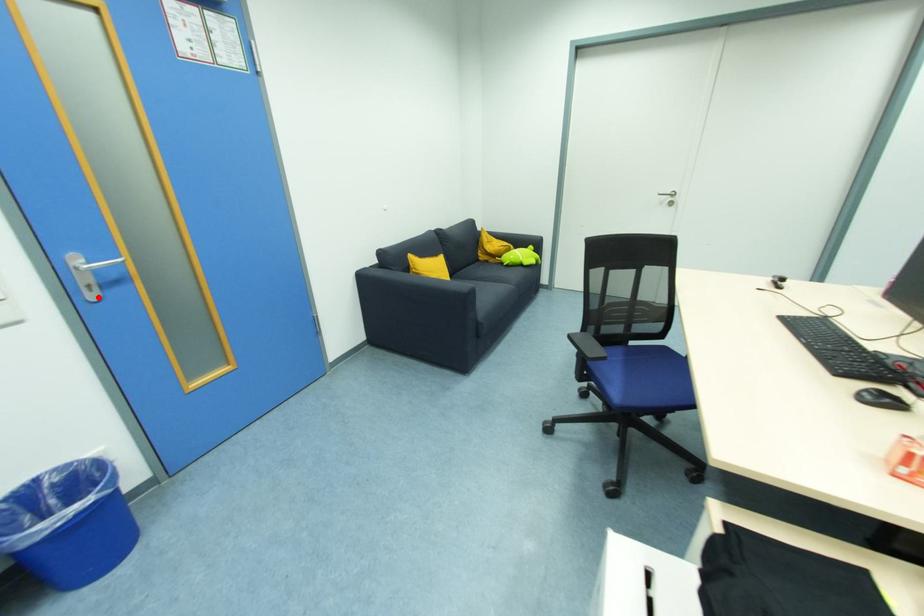
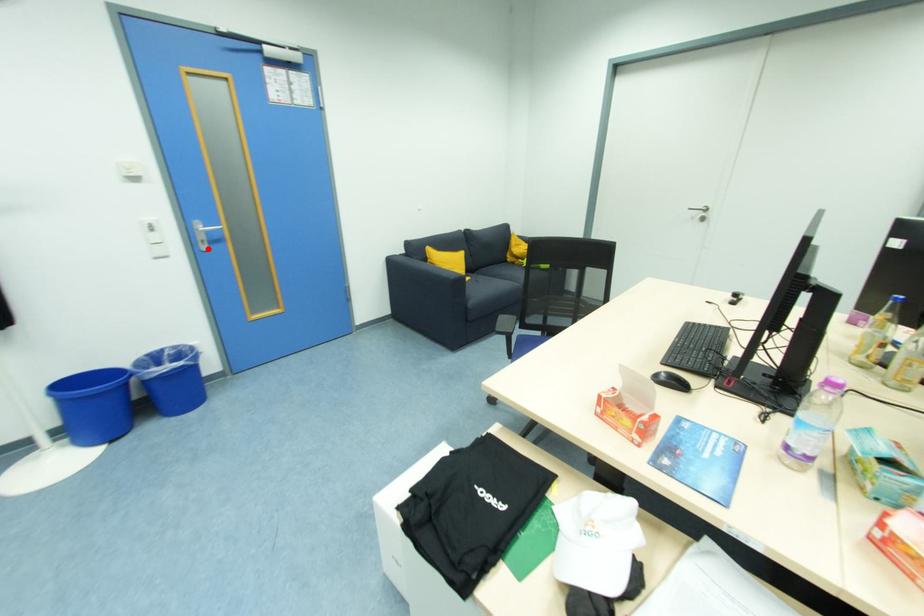
I am providing you with two images of the same scene from different viewpoints. A red point is marked on the first image and another point is marked on the second image. Do the highlighted points in image1 and image2 indicate the same real-world spot?

Yes